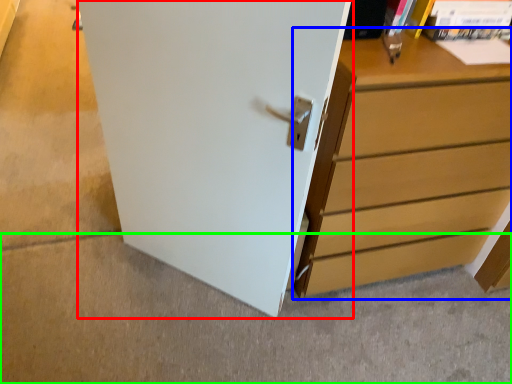
Question: Which is nearer to the door (highlighted by a red box)? chest of drawers (highlighted by a blue box) or concrete (highlighted by a green box).

Choices:
 (A) chest of drawers
 (B) concrete

Answer: (A)